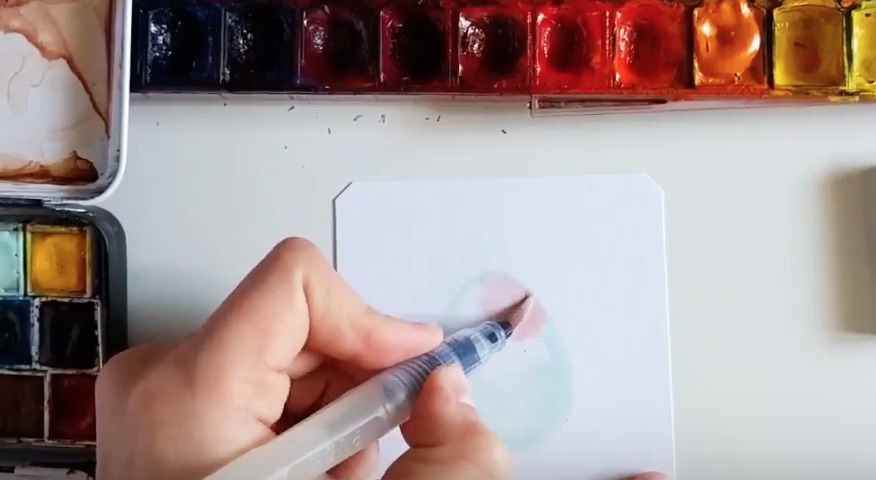
Locate an element on the screen. red paint is located at coordinates (560, 47).